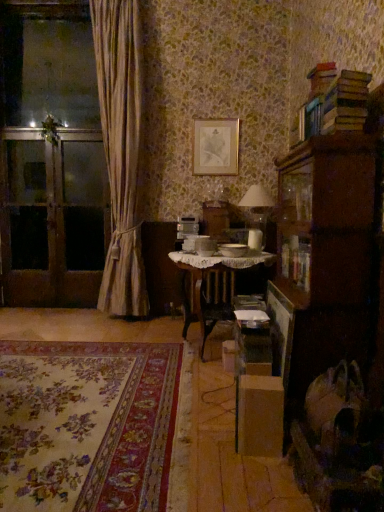
Question: Is brown wooden screen door at left, the 1th screen door from the left, shorter than gold metallic picture frame at upper center?

Choices:
 (A) yes
 (B) no

Answer: (B)

Question: Can you confirm if brown wooden screen door at left, positioned as the 3th screen door in right-to-left order, is positioned to the left of gold metallic picture frame at upper center?

Choices:
 (A) yes
 (B) no

Answer: (A)

Question: Is the position of brown wooden screen door at left, the 1th screen door from the left, less distant than that of gold metallic picture frame at upper center?

Choices:
 (A) no
 (B) yes

Answer: (A)

Question: Can gold metallic picture frame at upper center be found inside brown wooden screen door at left, positioned as the 3th screen door in right-to-left order?

Choices:
 (A) yes
 (B) no

Answer: (B)

Question: From a real-world perspective, does brown wooden screen door at left, the 1th screen door from the left, sit lower than gold metallic picture frame at upper center?

Choices:
 (A) no
 (B) yes

Answer: (B)

Question: From a real-world perspective, is brown wooden screen door at left, positioned as the 3th screen door in right-to-left order, on top of gold metallic picture frame at upper center?

Choices:
 (A) no
 (B) yes

Answer: (A)

Question: Does transparent glass screen door at left, which appears as the first screen door when viewed from the right, lie in front of wooden cabinet at right?

Choices:
 (A) no
 (B) yes

Answer: (A)

Question: Is transparent glass screen door at left, which appears as the first screen door when viewed from the right, facing towards wooden cabinet at right?

Choices:
 (A) no
 (B) yes

Answer: (A)

Question: Considering the relative sizes of transparent glass screen door at left, which appears as the first screen door when viewed from the right, and wooden cabinet at right in the image provided, is transparent glass screen door at left, which appears as the first screen door when viewed from the right, bigger than wooden cabinet at right?

Choices:
 (A) yes
 (B) no

Answer: (B)

Question: Is transparent glass screen door at left, which appears as the first screen door when viewed from the right, smaller than wooden cabinet at right?

Choices:
 (A) yes
 (B) no

Answer: (A)

Question: From the image's perspective, is transparent glass screen door at left, which appears as the first screen door when viewed from the right, on wooden cabinet at right?

Choices:
 (A) yes
 (B) no

Answer: (A)

Question: From a real-world perspective, is transparent glass screen door at left, which is the 3th screen door from left to right, under wooden cabinet at right?

Choices:
 (A) no
 (B) yes

Answer: (A)

Question: Are brown wooden screen door at left, the 1th screen door from the left, and floral carpet at lower left far apart?

Choices:
 (A) yes
 (B) no

Answer: (A)